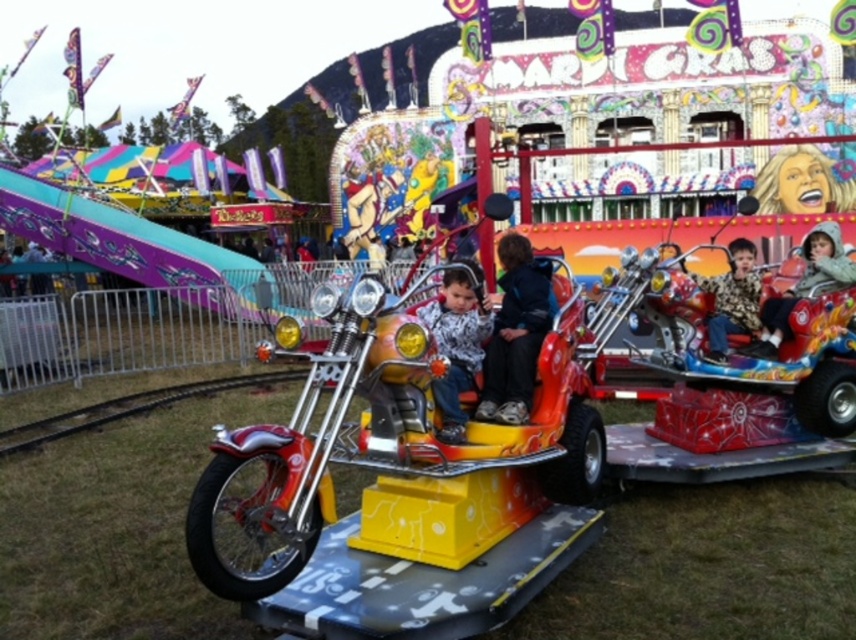
Does printed fabric shirt at center come in front of matte black jacket at upper right?

Yes, printed fabric shirt at center is closer to the viewer.

Is printed fabric shirt at center smaller than matte black jacket at upper right?

Correct, printed fabric shirt at center occupies less space than matte black jacket at upper right.

Find the location of `printed fabric shirt at center`. printed fabric shirt at center is located at coordinates (456, 342).

Is point (524, 413) closer to camera compared to point (829, 236)?

Yes, point (524, 413) is closer to viewer.

Can you confirm if dark blue jacket at center is shorter than matte black jacket at upper right?

In fact, dark blue jacket at center may be taller than matte black jacket at upper right.

This screenshot has height=640, width=856. Find the location of `dark blue jacket at center`. dark blue jacket at center is located at coordinates (516, 332).

Where is `dark blue jacket at center`? This screenshot has height=640, width=856. dark blue jacket at center is located at coordinates (516, 332).

Which is below, shiny chrome motorcycle at center or matte black jacket at upper right?

shiny chrome motorcycle at center is below.

Does point (572, 321) come closer to viewer compared to point (798, 298)?

Yes.

Where is `shiny chrome motorcycle at center`? This screenshot has width=856, height=640. shiny chrome motorcycle at center is located at coordinates (397, 483).